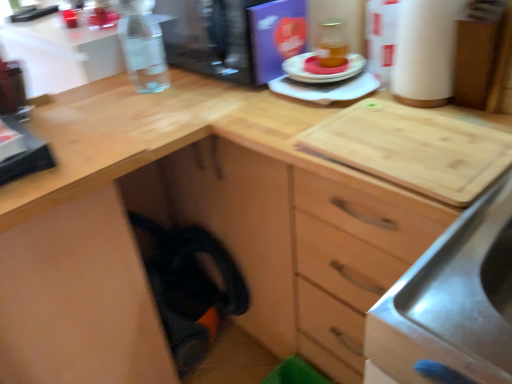
I want to click on vacant area situated to the left side of matte orange cake at center, so click(x=275, y=79).